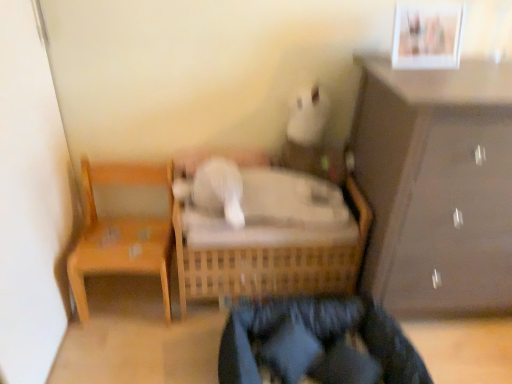
Question: Considering the relative positions of matte brown cabinet at right and wooden chair at left in the image provided, is matte brown cabinet at right to the left or to the right of wooden chair at left?

Choices:
 (A) right
 (B) left

Answer: (A)

Question: Does point (433, 195) appear closer or farther from the camera than point (163, 269)?

Choices:
 (A) farther
 (B) closer

Answer: (B)

Question: Which object is the farthest from the matte brown cabinet at right?

Choices:
 (A) white glossy picture frame at upper right
 (B) dark blue fabric pants at lower center
 (C) wooden chair at left
 (D) woven wood crib at center

Answer: (C)

Question: Considering the real-world distances, which object is closest to the wooden chair at left?

Choices:
 (A) woven wood crib at center
 (B) matte brown cabinet at right
 (C) dark blue fabric pants at lower center
 (D) white glossy picture frame at upper right

Answer: (A)